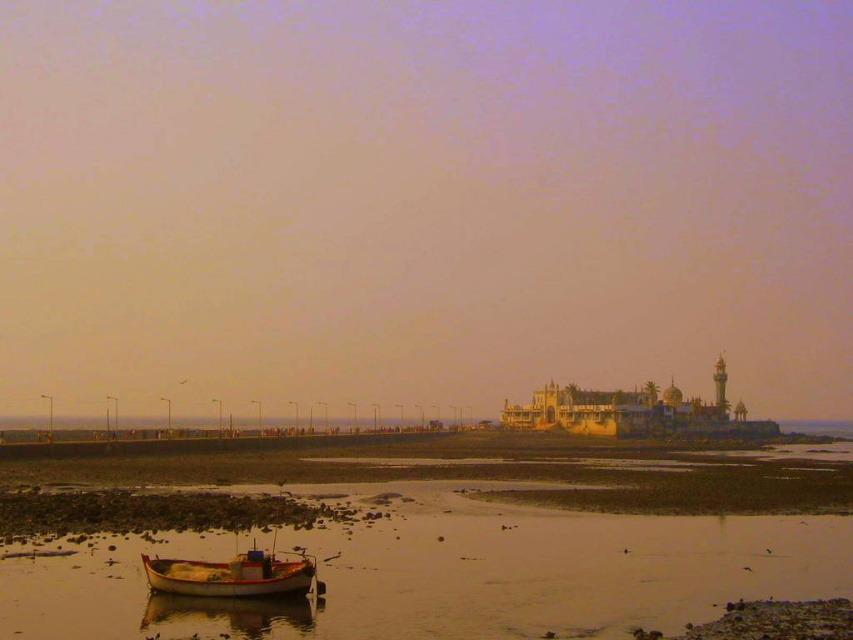
Is smooth sand beach at lower left below wooden boat at lower left?

Correct, smooth sand beach at lower left is located below wooden boat at lower left.

Is smooth sand beach at lower left positioned at the back of wooden boat at lower left?

No, smooth sand beach at lower left is closer to the viewer.

Identify the location of smooth sand beach at lower left. (440, 572).